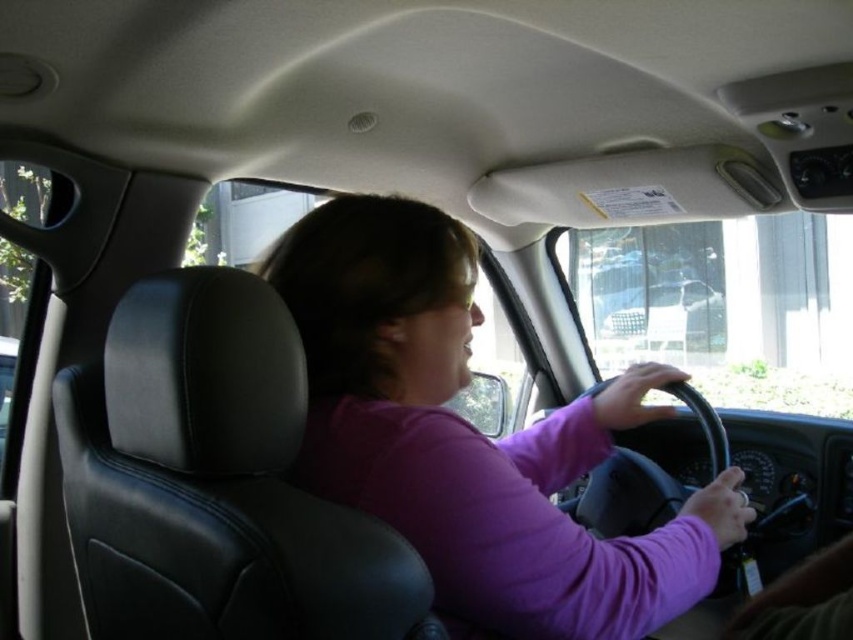
You are sitting in the passenger seat of the car and want to reach a small object located at point (x=326, y=272). If your arm can extend 1 meter, can you comfortably reach it?

The distance of point (x=326, y=272) from the viewer is 1.07 meters, so your arm can only extend 1 meter. Therefore, you cannot comfortably reach the object at point (x=326, y=272).

You are a passenger in the car and want to point out the purple matte shirt at center to someone outside the metallic silver car at center. Which side of the car should you indicate?

The purple matte shirt at center is on the left side of the metallic silver car at center, so you should indicate the left side of the car.

You are sitting in the passenger seat of the car and notice a point at coordinates (473, 438). What object is located at that point?

The point at coordinates (473, 438) is occupied by the purple matte shirt at center.